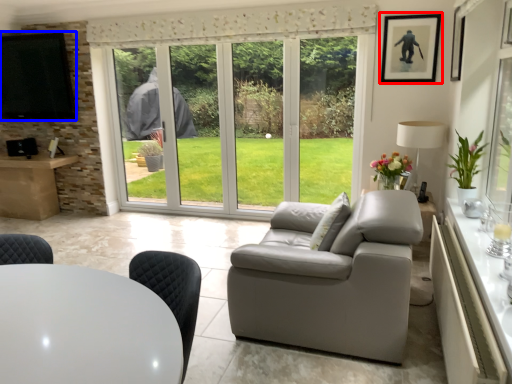
Question: Which object is further to the camera taking this photo, picture frame (highlighted by a red box) or window screen (highlighted by a blue box)?

Choices:
 (A) picture frame
 (B) window screen

Answer: (B)